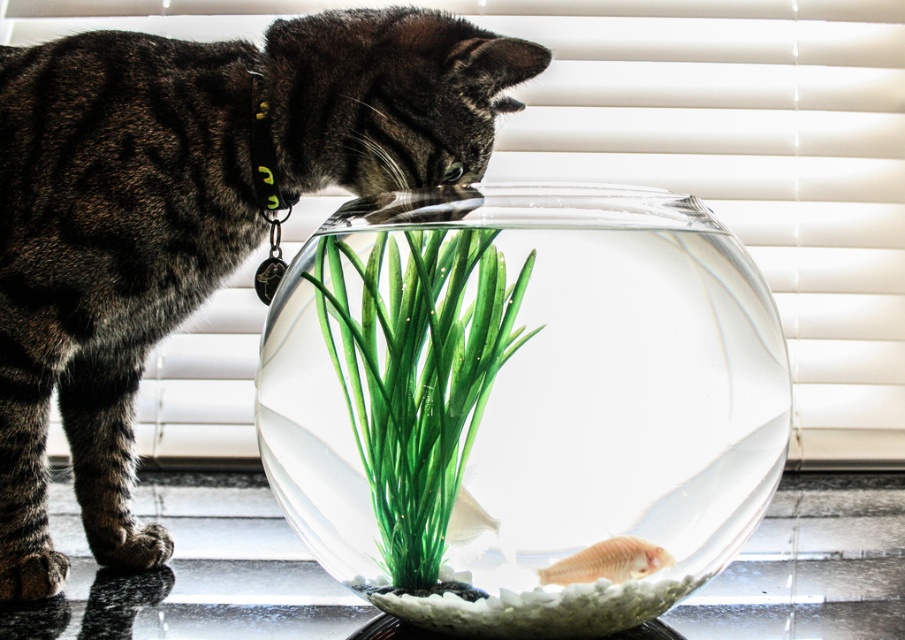
Question: Does green plastic plant at center have a smaller size compared to translucent plastic fish at center?

Choices:
 (A) yes
 (B) no

Answer: (B)

Question: Can you confirm if transparent glass bowl at center is positioned below dark brown fur cat at left?

Choices:
 (A) yes
 (B) no

Answer: (A)

Question: Which object appears farthest from the camera in this image?

Choices:
 (A) dark brown fur cat at left
 (B) green plastic plant at center
 (C) transparent glass bowl at center
 (D) translucent plastic fish at center

Answer: (A)

Question: Which point is closer to the camera?

Choices:
 (A) translucent plastic fish at center
 (B) dark brown fur cat at left
 (C) transparent glass bowl at center

Answer: (C)

Question: Which point is closer to the camera?

Choices:
 (A) transparent glass bowl at center
 (B) translucent plastic fish at center
 (C) green plastic plant at center
 (D) dark brown fur cat at left

Answer: (A)

Question: Does transparent glass bowl at center come behind dark brown fur cat at left?

Choices:
 (A) no
 (B) yes

Answer: (A)